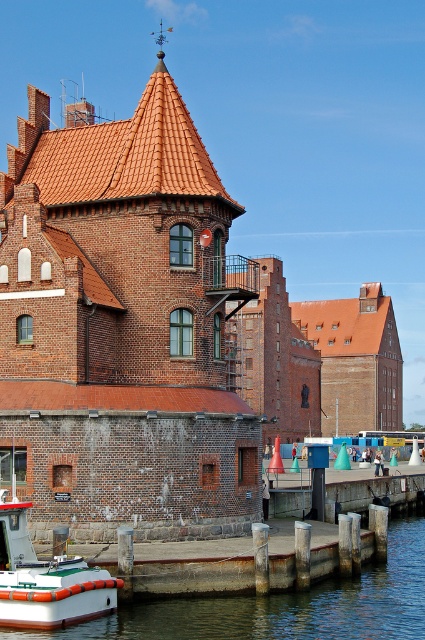
Can you confirm if smooth concrete water at lower left is shorter than white rubber boat at lower left?

No.

Does smooth concrete water at lower left have a smaller size compared to white rubber boat at lower left?

No, smooth concrete water at lower left is not smaller than white rubber boat at lower left.

Does point (416, 612) come behind point (87, 614)?

That is True.

Identify the location of smooth concrete water at lower left. 282,605.